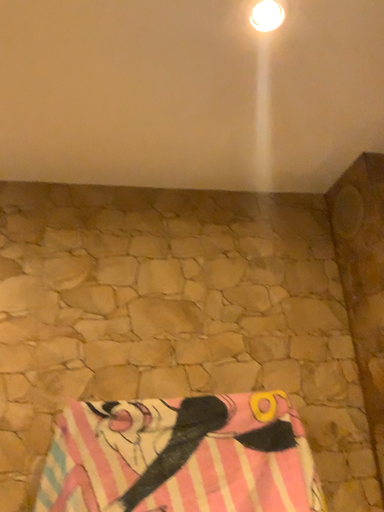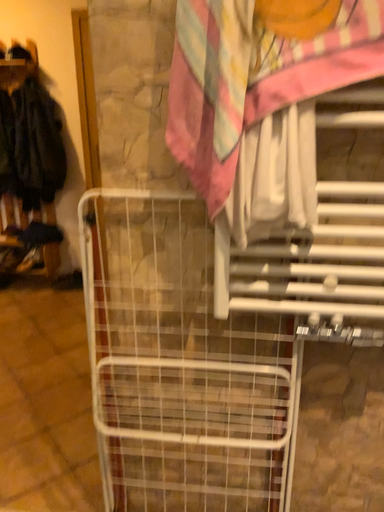
Question: Which way did the camera rotate in the video?

Choices:
 (A) rotated downward
 (B) rotated upward

Answer: (A)